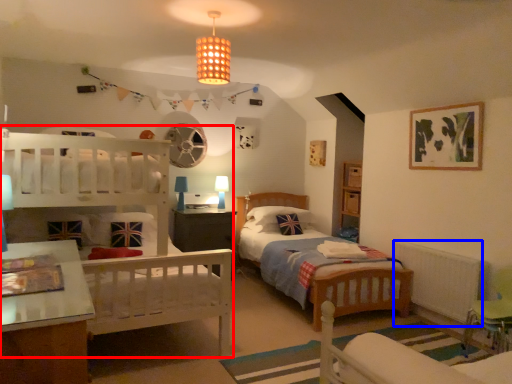
Question: Which object is closer to the camera taking this photo, bunk bed (highlighted by a red box) or radiator (highlighted by a blue box)?

Choices:
 (A) bunk bed
 (B) radiator

Answer: (A)